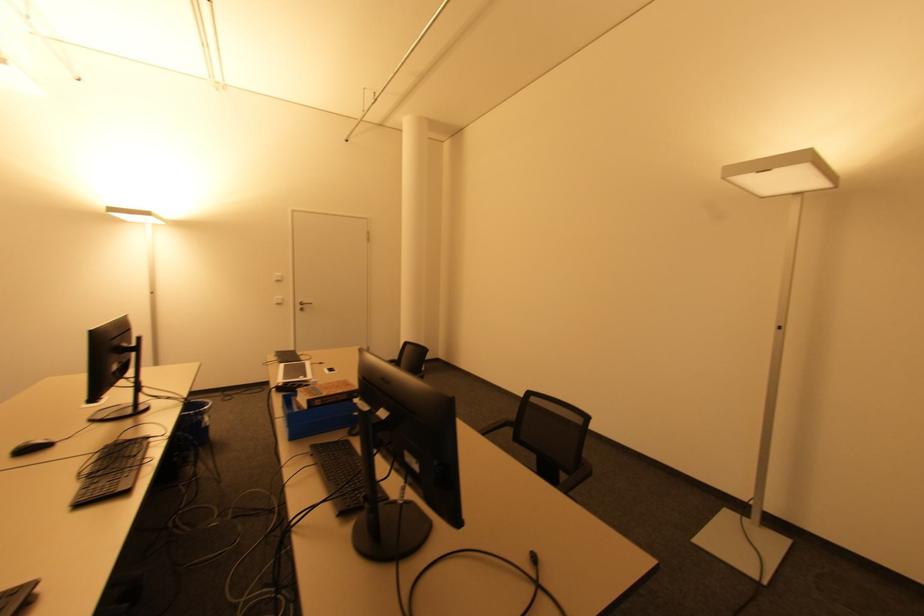
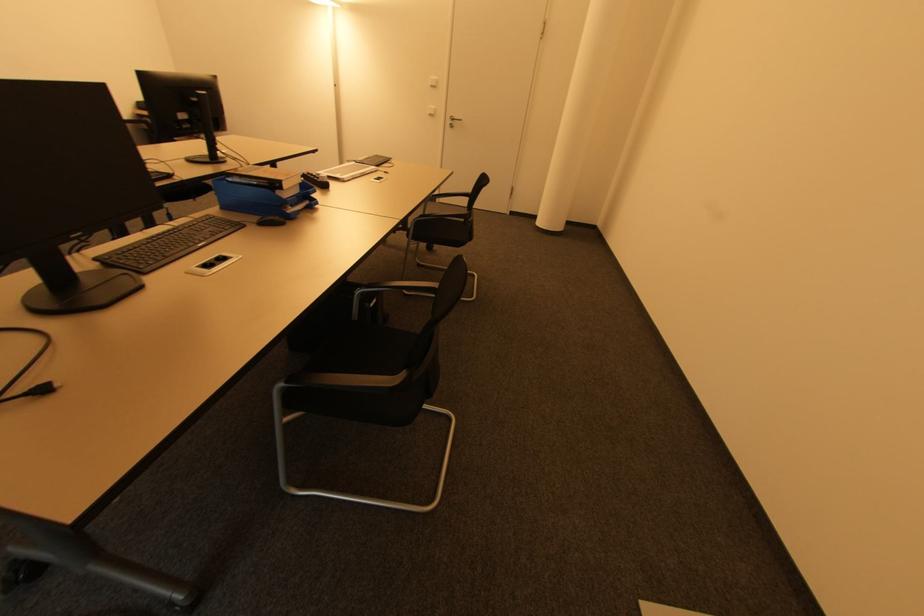
Where in the second image is the point corresponding to point (280, 299) from the first image?

(433, 108)